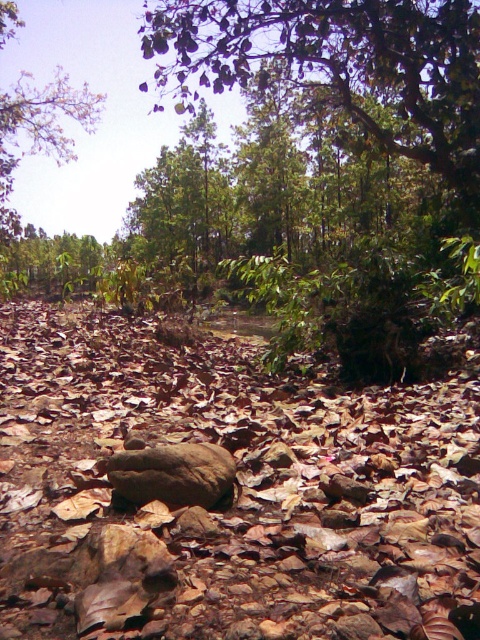
You are standing in the outdoor scene and want to take a photo of both the green leafy tree at upper left and the brown rough boulder at center. Which object should you adjust your camera angle upwards to capture in the frame?

You should adjust your camera angle upwards to capture the green leafy tree at upper left because it is located above the brown rough boulder at center.

You are standing in the middle of the scene and see the brown rough rock at center and the brown rough boulder at center. Which one is positioned to the right side?

The brown rough rock at center is positioned to the right of the brown rough boulder at center.

You are a hiker who wants to place a small camping stool on the ground. You have two options for placement spots near the brown rough rock at center and the brown rough boulder at center. Which spot would you choose if you want the stool to be higher off the ground?

The brown rough rock at center has a greater height compared to the brown rough boulder at center, so placing the stool on the brown rough rock at center would make it higher off the ground.